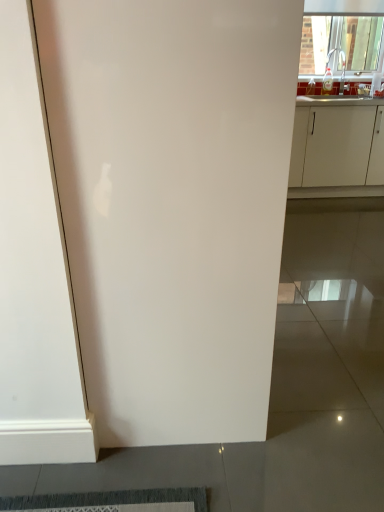
Question: Considering the positions of transparent glass window at upper right and white matte cabinet at right in the image, is transparent glass window at upper right bigger or smaller than white matte cabinet at right?

Choices:
 (A) big
 (B) small

Answer: (B)

Question: Is point (311, 64) positioned closer to the camera than point (289, 182)?

Choices:
 (A) farther
 (B) closer

Answer: (A)

Question: Estimate the real-world distances between objects in this image. Which object is farther from the white matte cabinet at right?

Choices:
 (A) white glossy door at center
 (B) transparent glass window at upper right

Answer: (A)

Question: Which is farther from the white matte cabinet at right?

Choices:
 (A) transparent glass window at upper right
 (B) white glossy door at center

Answer: (B)